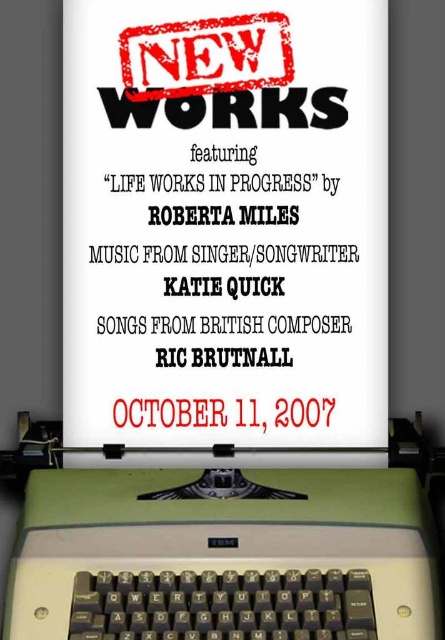
Does white paper at center appear over green plastic typewriter at bottom?

Correct, white paper at center is located above green plastic typewriter at bottom.

Which of these two, white paper at center or green plastic typewriter at bottom, stands taller?

white paper at center is taller.

Between point (202, 84) and point (43, 433), which one is positioned behind?

Positioned behind is point (43, 433).

I want to click on white paper at center, so point(225,221).